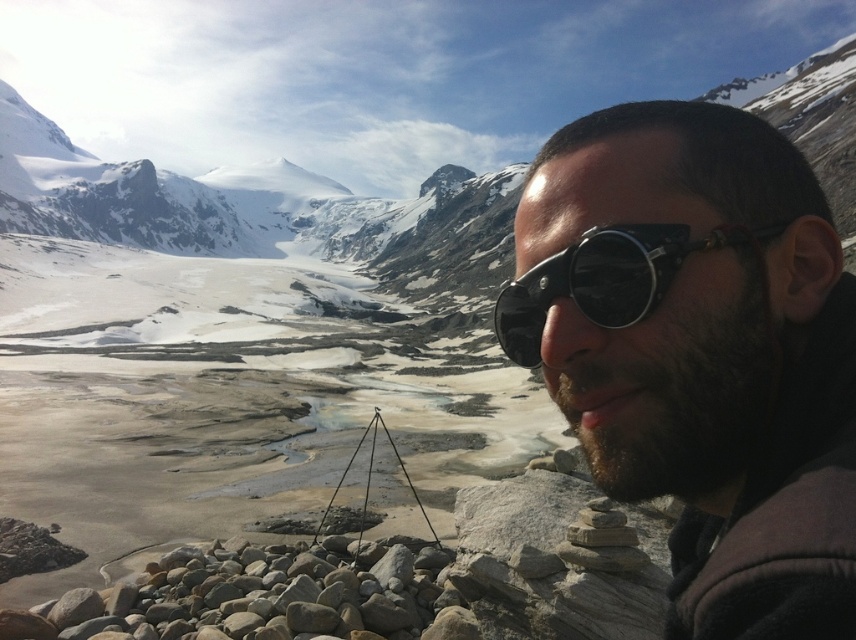
Is the position of smooth gray rocks at lower left less distant than that of black matte goggles at right?

No, it is not.

Who is more distant from viewer, (282, 582) or (627, 252)?

Point (282, 582)

The height and width of the screenshot is (640, 856). In order to click on smooth gray rocks at lower left in this screenshot , I will do `click(253, 595)`.

Is point (660, 456) positioned after point (520, 321)?

No.

Is dark brown fuzzy beard at right closer to camera compared to black matte goggles at right?

Yes, it is in front of black matte goggles at right.

The width and height of the screenshot is (856, 640). Describe the element at coordinates (669, 388) in the screenshot. I see `dark brown fuzzy beard at right` at that location.

Where is `dark brown fuzzy beard at right`? The image size is (856, 640). dark brown fuzzy beard at right is located at coordinates (669, 388).

Consider the image. Which of these two, matte black sunglasses at center or dark brown fuzzy beard at right, stands shorter?

Standing shorter between the two is dark brown fuzzy beard at right.

Which is more to the right, matte black sunglasses at center or dark brown fuzzy beard at right?

matte black sunglasses at center is more to the right.

Is point (670, 104) positioned after point (703, 468)?

Yes.

Find the location of `matte black sunglasses at center`. matte black sunglasses at center is located at coordinates (700, 353).